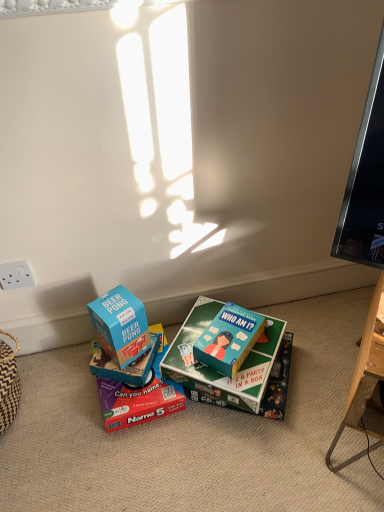
The height and width of the screenshot is (512, 384). I want to click on unoccupied area in front of blue cardboard box at center, acting as the 5th box starting from the right, so click(x=127, y=396).